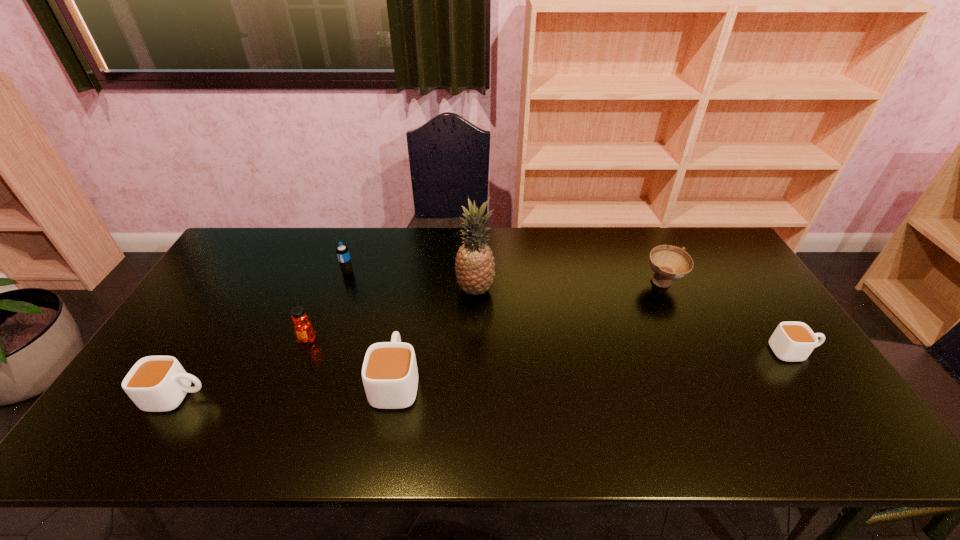
Locate which cup is the closest to the third object from right to left. Please provide its 2D coordinates. Your answer should be formatted as a tuple, i.e. [(x, y)], where the tuple contains the x and y coordinates of a point satisfying the conditions above.

[(389, 372)]

Where is `cup identified as the second closest to the second object from left to right`? cup identified as the second closest to the second object from left to right is located at coordinates (155, 383).

Locate an element on the screen. The width and height of the screenshot is (960, 540). free region that satisfies the following two spatial constraints: 1. on the front label of the sixth object from right to left; 2. on the side with the handle of the second tallest cup is located at coordinates (285, 396).